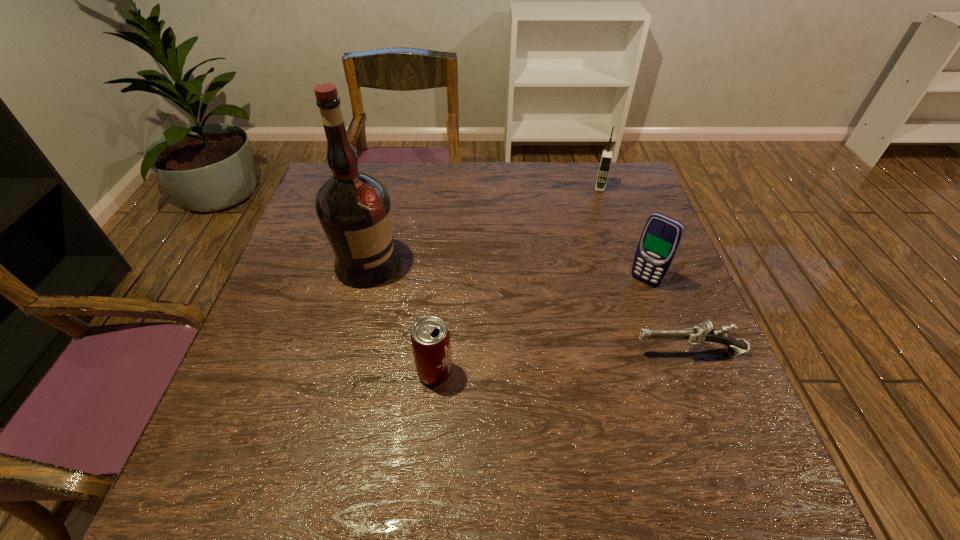
Locate an element on the screen. The width and height of the screenshot is (960, 540). object that is at the far edge is located at coordinates (606, 158).

What are the coordinates of `object present at the left edge` in the screenshot? It's located at (354, 208).

Where is `gun present at the right edge`? The height and width of the screenshot is (540, 960). gun present at the right edge is located at coordinates (703, 335).

Image resolution: width=960 pixels, height=540 pixels. What are the coordinates of `object located in the far right corner section of the desktop` in the screenshot? It's located at (606, 158).

The height and width of the screenshot is (540, 960). In the image, there is a desktop. What are the coordinates of `vacant space at the far edge` in the screenshot? It's located at (516, 171).

The width and height of the screenshot is (960, 540). Find the location of `free space at the near edge of the desktop`. free space at the near edge of the desktop is located at coordinates (650, 409).

In the image, there is a desktop. Identify the location of vacant space at the left edge. The image size is (960, 540). (322, 312).

This screenshot has height=540, width=960. In the image, there is a desktop. What are the coordinates of `vacant space at the right edge` in the screenshot? It's located at (639, 220).

The width and height of the screenshot is (960, 540). In the image, there is a desktop. Find the location of `free space at the far left corner`. free space at the far left corner is located at coordinates (318, 186).

The width and height of the screenshot is (960, 540). Identify the location of free space between the shortest object and the leftmost object. (528, 308).